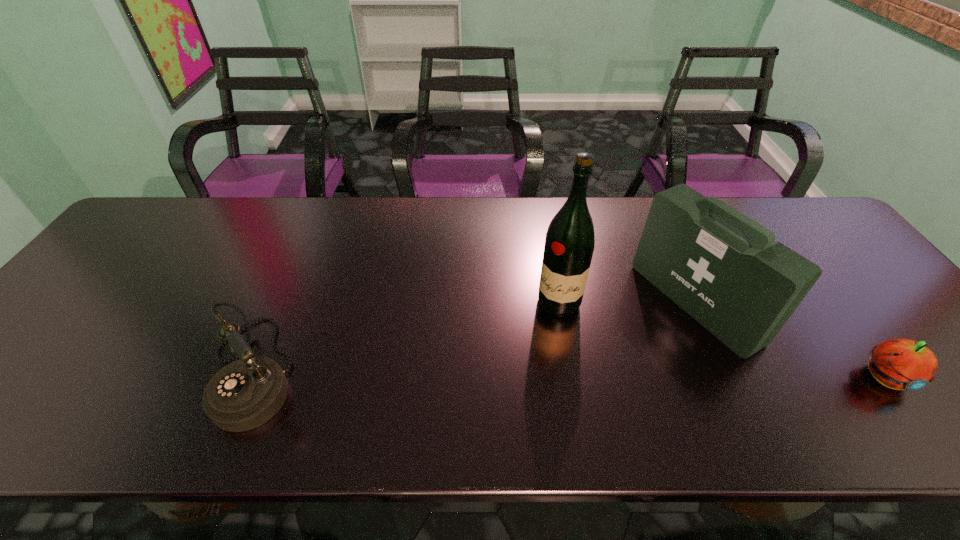
At what (x,y) coordinates should I click in order to perform the action: click on free location at the near edge. Please return your answer as a coordinate pair (x, y). Image resolution: width=960 pixels, height=540 pixels. Looking at the image, I should click on (439, 383).

I want to click on vacant space at the right edge of the desktop, so click(882, 334).

You are a GUI agent. You are given a task and a screenshot of the screen. Output one action in this format:
    pyautogui.click(x=<x>, y=<y>)
    Task: Click on the free space at the far left corner of the desktop
    The width and height of the screenshot is (960, 540).
    Given the screenshot: What is the action you would take?
    pyautogui.click(x=156, y=200)

In the image, there is a desktop. What are the coordinates of `vacant space at the far right corner` in the screenshot? It's located at coord(808,208).

This screenshot has width=960, height=540. I want to click on vacant space at the near right corner, so click(x=905, y=392).

This screenshot has height=540, width=960. I want to click on free space between the second shortest object and the first-aid kit, so [475, 336].

The height and width of the screenshot is (540, 960). Find the location of `free area in between the third object from right to left and the third shortest object`. free area in between the third object from right to left and the third shortest object is located at coordinates (627, 303).

Locate an element on the screen. This screenshot has height=540, width=960. free space between the leftmost object and the shortest object is located at coordinates (569, 373).

Locate an element on the screen. This screenshot has width=960, height=540. vacant point located between the tallest object and the second tallest object is located at coordinates (627, 303).

Where is `free spot between the first-aid kit and the second object from left to right`? The height and width of the screenshot is (540, 960). free spot between the first-aid kit and the second object from left to right is located at coordinates (627, 303).